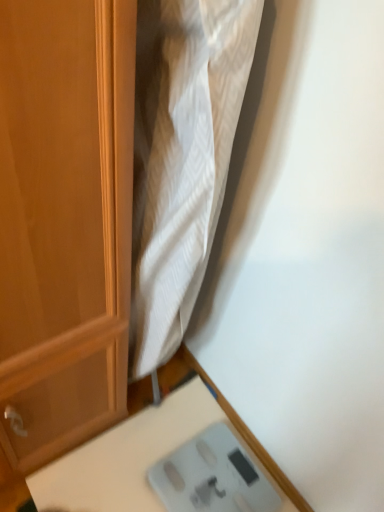
Find the location of `free space to the left of gray plastic scale at lower right`. free space to the left of gray plastic scale at lower right is located at coordinates (132, 463).